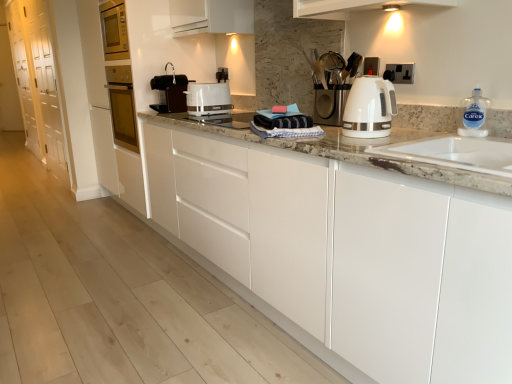
Question: Can you confirm if white glossy electric kettle at right, marked as the second home appliance in a back-to-front arrangement, is bigger than white glossy cabinets at center, arranged as the 1th cabinetry when viewed from the right?

Choices:
 (A) no
 (B) yes

Answer: (A)

Question: From the image's perspective, does white glossy electric kettle at right, which is counted as the first home appliance, starting from the right, appear higher than white glossy cabinets at center, arranged as the 1th cabinetry when viewed from the right?

Choices:
 (A) no
 (B) yes

Answer: (B)

Question: Is white glossy electric kettle at right, marked as the second home appliance in a back-to-front arrangement, wider than white glossy cabinets at center, arranged as the 1th cabinetry when viewed from the right?

Choices:
 (A) yes
 (B) no

Answer: (B)

Question: Is white glossy electric kettle at right, which is counted as the first home appliance, starting from the front, facing away from white glossy cabinets at center, arranged as the 1th cabinetry when viewed from the right?

Choices:
 (A) no
 (B) yes

Answer: (A)

Question: Is white glossy electric kettle at right, which appears as the 2th home appliance when viewed from the top, positioned far away from white glossy cabinets at center, arranged as the 1th cabinetry when viewed from the right?

Choices:
 (A) no
 (B) yes

Answer: (A)

Question: Is white glossy cabinet at left, placed as the first cabinetry when sorted from back to front, to the left or to the right of black plastic coffee machine at center, arranged as the 1th home appliance when viewed from the back, in the image?

Choices:
 (A) left
 (B) right

Answer: (A)

Question: Which is correct: white glossy cabinet at left, placed as the first cabinetry when sorted from back to front, is inside black plastic coffee machine at center, which is counted as the first home appliance, starting from the left, or outside of it?

Choices:
 (A) inside
 (B) outside

Answer: (B)

Question: Does point (52, 144) appear closer or farther from the camera than point (183, 102)?

Choices:
 (A) closer
 (B) farther

Answer: (B)

Question: From the image's perspective, is white glossy cabinet at left, placed as the first cabinetry when sorted from back to front, above or below black plastic coffee machine at center, arranged as the 1th home appliance when viewed from the back?

Choices:
 (A) below
 (B) above

Answer: (B)

Question: From the image's perspective, is black plastic coffee machine at center, which is counted as the first home appliance, starting from the left, located above or below white glossy cabinets at center, marked as the 1th cabinetry in a front-to-back arrangement?

Choices:
 (A) below
 (B) above

Answer: (B)

Question: Is black plastic coffee machine at center, which ranks as the first home appliance in top-to-bottom order, inside or outside of white glossy cabinets at center, arranged as the 1th cabinetry when viewed from the right?

Choices:
 (A) outside
 (B) inside

Answer: (A)

Question: Looking at the image, does black plastic coffee machine at center, arranged as the 1th home appliance when viewed from the back, seem bigger or smaller compared to white glossy cabinets at center, which appears as the second cabinetry when viewed from the back?

Choices:
 (A) small
 (B) big

Answer: (A)

Question: From a real-world perspective, relative to white glossy cabinets at center, marked as the 1th cabinetry in a front-to-back arrangement, is black plastic coffee machine at center, which is the second home appliance from bottom to top, vertically above or below?

Choices:
 (A) below
 (B) above

Answer: (B)

Question: Is clear plastic bottle at right situated inside black plastic coffee machine at center, positioned as the 2th home appliance in front-to-back order, or outside?

Choices:
 (A) outside
 (B) inside

Answer: (A)

Question: Considering the relative positions of clear plastic bottle at right and black plastic coffee machine at center, which is counted as the first home appliance, starting from the left, in the image provided, is clear plastic bottle at right to the left or to the right of black plastic coffee machine at center, which is counted as the first home appliance, starting from the left,?

Choices:
 (A) left
 (B) right

Answer: (B)